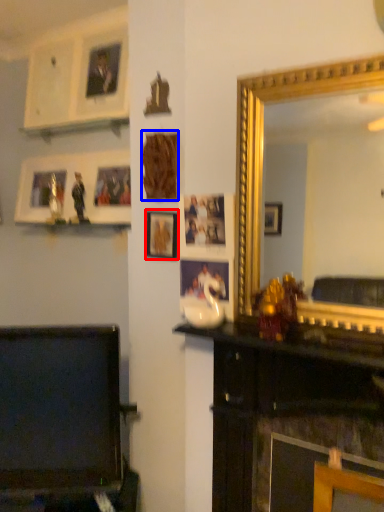
Question: Among these objects, which one is nearest to the camera, picture frame (highlighted by a red box) or picture frame (highlighted by a blue box)?

Choices:
 (A) picture frame
 (B) picture frame

Answer: (B)